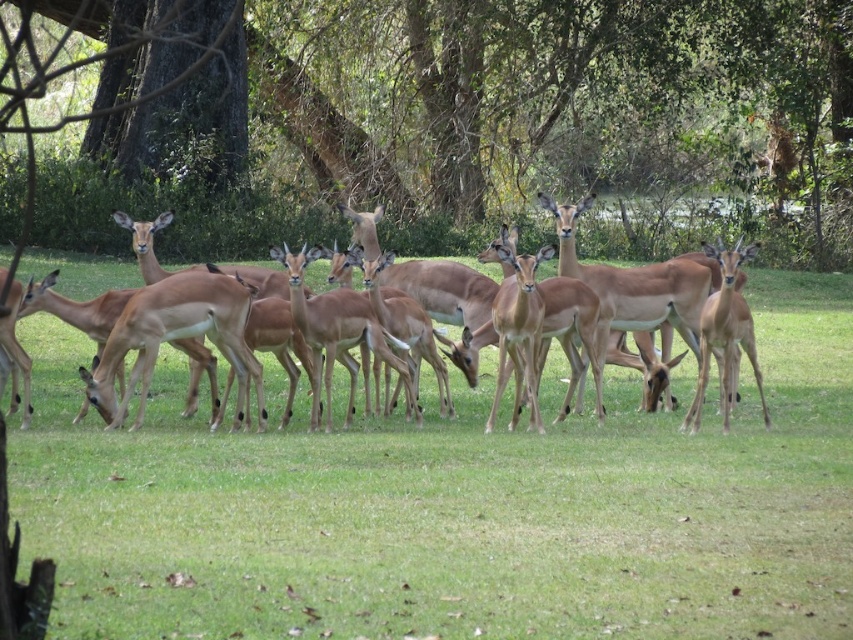
Question: Does smooth brown antelope at center have a larger size compared to light brown antelope at center?

Choices:
 (A) no
 (B) yes

Answer: (B)

Question: Which point is closer to the camera?

Choices:
 (A) (697, 273)
 (B) (770, 74)
 (C) (22, 376)
 (D) (724, 369)

Answer: (C)

Question: Based on their relative distances, which object is farther from the brown wood tree at upper center?

Choices:
 (A) brown matte/deer at center
 (B) smooth brown antelope at center

Answer: (B)

Question: Is brown smooth antelope at center to the left of light brown antelope at center from the viewer's perspective?

Choices:
 (A) no
 (B) yes

Answer: (A)

Question: Where is brown smooth antelope at center located in relation to smooth brown antelope at center in the image?

Choices:
 (A) above
 (B) below

Answer: (B)

Question: Which of the following is the closest to the observer?

Choices:
 (A) light brown antelope at center
 (B) smooth brown antelope at center
 (C) brown wood tree at upper center
 (D) brown smooth antelope at center

Answer: (D)